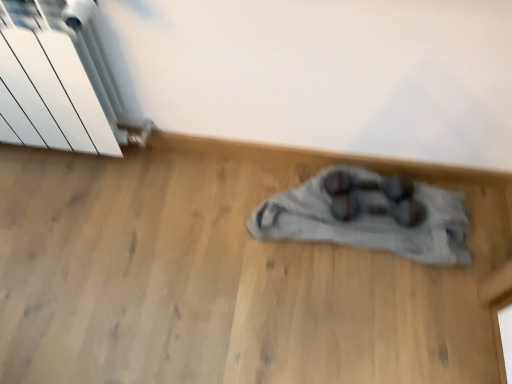
Question: Does white metallic radiator at upper left have a greater width compared to shiny black dumbbells at center?

Choices:
 (A) no
 (B) yes

Answer: (A)

Question: Would you say white metallic radiator at upper left is outside shiny black dumbbells at center?

Choices:
 (A) no
 (B) yes

Answer: (B)

Question: Is white metallic radiator at upper left to the left of shiny black dumbbells at center from the viewer's perspective?

Choices:
 (A) yes
 (B) no

Answer: (A)

Question: Considering the relative sizes of white metallic radiator at upper left and shiny black dumbbells at center in the image provided, is white metallic radiator at upper left shorter than shiny black dumbbells at center?

Choices:
 (A) yes
 (B) no

Answer: (B)

Question: From a real-world perspective, is white metallic radiator at upper left located beneath shiny black dumbbells at center?

Choices:
 (A) yes
 (B) no

Answer: (B)

Question: Is shiny black dumbbells at center at the back of white metallic radiator at upper left?

Choices:
 (A) no
 (B) yes

Answer: (A)

Question: Does shiny black dumbbells at center have a lesser width compared to white metallic radiator at upper left?

Choices:
 (A) no
 (B) yes

Answer: (A)

Question: Considering the relative sizes of shiny black dumbbells at center and white metallic radiator at upper left in the image provided, is shiny black dumbbells at center smaller than white metallic radiator at upper left?

Choices:
 (A) no
 (B) yes

Answer: (B)

Question: Does shiny black dumbbells at center have a larger size compared to white metallic radiator at upper left?

Choices:
 (A) yes
 (B) no

Answer: (B)

Question: From a real-world perspective, is shiny black dumbbells at center positioned under white metallic radiator at upper left based on gravity?

Choices:
 (A) no
 (B) yes

Answer: (B)

Question: From the image's perspective, is shiny black dumbbells at center over white metallic radiator at upper left?

Choices:
 (A) yes
 (B) no

Answer: (B)

Question: Is shiny black dumbbells at center with white metallic radiator at upper left?

Choices:
 (A) no
 (B) yes

Answer: (A)

Question: Is shiny black dumbbells at center spatially inside white metallic radiator at upper left, or outside of it?

Choices:
 (A) outside
 (B) inside

Answer: (A)